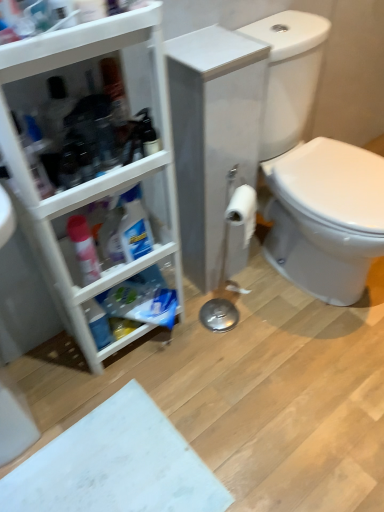
This screenshot has width=384, height=512. What are the coordinates of `free space in front of white glossy toilet at right` in the screenshot? It's located at (292, 372).